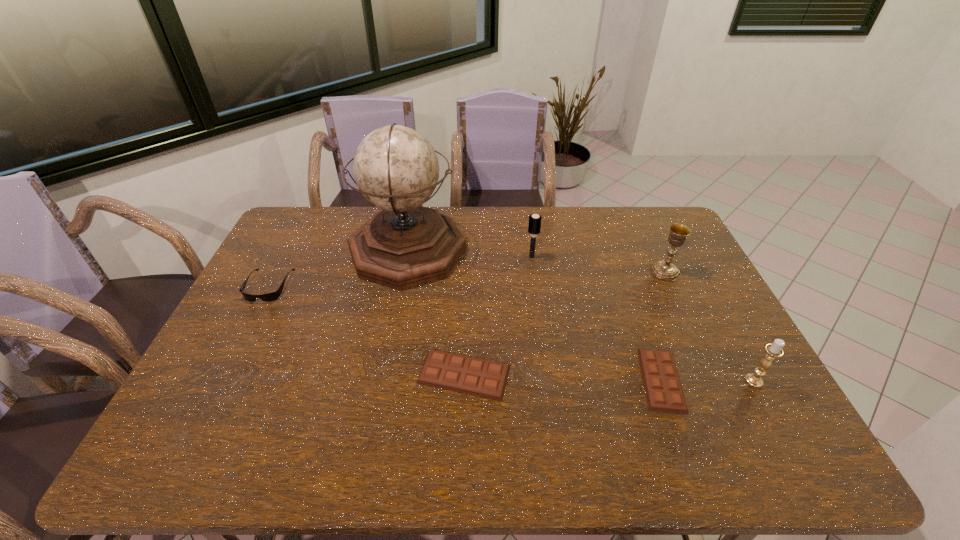
Find the location of a particular element. This screenshot has width=960, height=540. free spot between the candle holder and the second shortest object is located at coordinates (609, 377).

This screenshot has height=540, width=960. I want to click on vacant point located between the leftmost object and the left chocolate bar, so click(367, 330).

Find the location of a particular element. vacant point located between the right chocolate bar and the sixth object from left to right is located at coordinates (663, 326).

You are a GUI agent. You are given a task and a screenshot of the screen. Output one action in this format:
    pyautogui.click(x=<x>, y=<y>)
    Task: Click on the free space that is in between the fifth tallest object and the left chocolate bar
    Image resolution: width=960 pixels, height=540 pixels.
    Given the screenshot: What is the action you would take?
    pyautogui.click(x=367, y=330)

Identify the location of vacant region between the sunglasses and the taller chocolate bar. This screenshot has height=540, width=960. (367, 330).

This screenshot has height=540, width=960. What are the coordinates of `free area in between the chalice and the sunglasses` in the screenshot? It's located at (467, 279).

At what (x,y) coordinates should I click in order to perform the action: click on object that is the fifth nearest to the sixth object from left to right. Please return your answer as a coordinate pair (x, y). The width and height of the screenshot is (960, 540). Looking at the image, I should click on (403, 245).

Locate which object ranks third in proximity to the shorter chocolate bar. Please provide its 2D coordinates. Your answer should be formatted as a tuple, i.e. [(x, y)], where the tuple contains the x and y coordinates of a point satisfying the conditions above.

[(463, 374)]

Locate an element on the screen. The height and width of the screenshot is (540, 960). vacant region that satisfies the following two spatial constraints: 1. on the surface of the chalice; 2. on the left side of the globe is located at coordinates (404, 271).

In order to click on vacant space that satisfies the following two spatial constraints: 1. on the front side of the rightmost object; 2. on the left side of the sixth tallest object in this screenshot , I will do `click(464, 381)`.